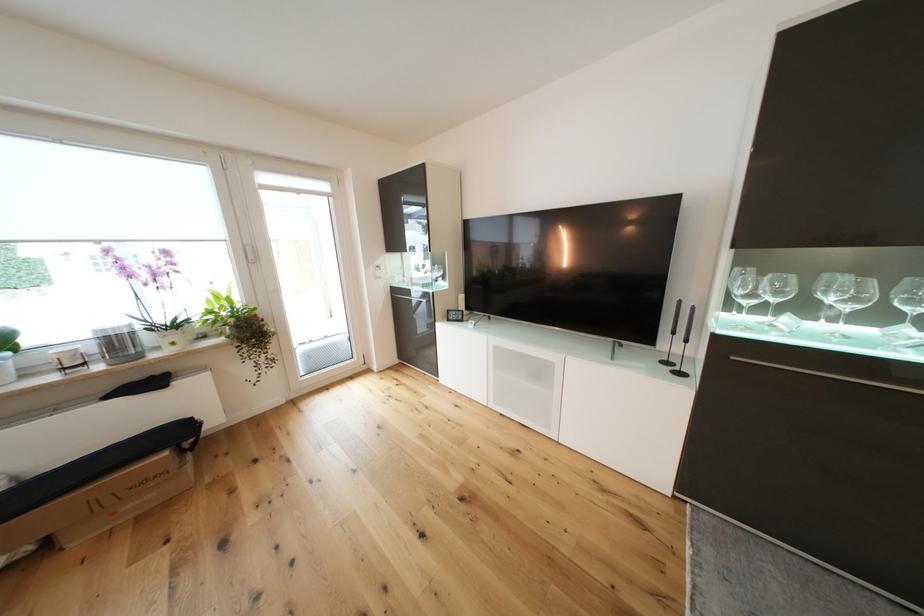
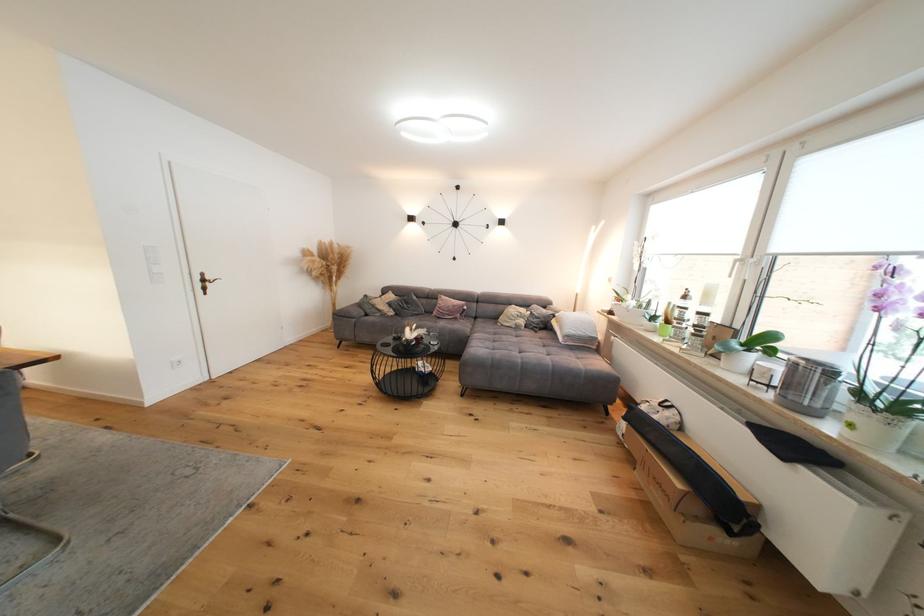
Find the pixel in the second image that matches (172,455) in the first image.

(687, 488)